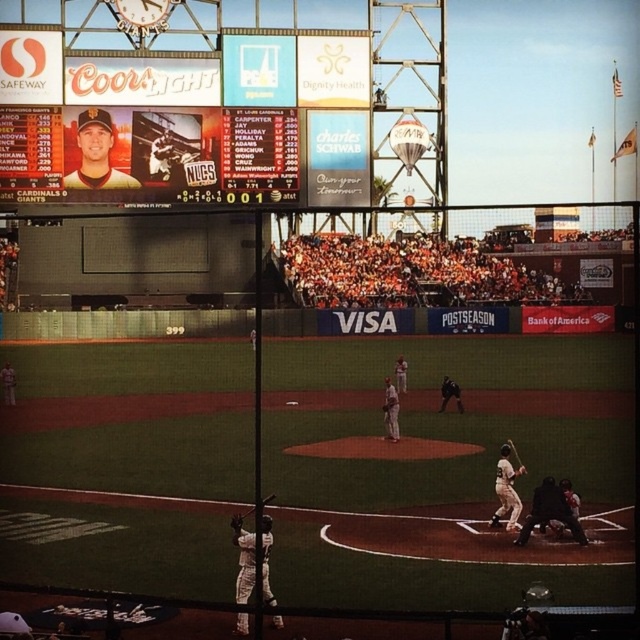
Can you confirm if matte plastic scoreboard at upper center is wider than white uniform bat at center?

Correct, the width of matte plastic scoreboard at upper center exceeds that of white uniform bat at center.

Between point (44, 38) and point (518, 502), which one is positioned behind?

The point (44, 38) is more distant.

Identify the location of matte plastic scoreboard at upper center. (160, 124).

This screenshot has height=640, width=640. What are the coordinates of `matte plastic scoreboard at upper center` in the screenshot? It's located at click(x=160, y=124).

Which is more to the right, matte plastic scoreboard at upper center or wooden baseball bat at center?

From the viewer's perspective, wooden baseball bat at center appears more on the right side.

Consider the image. Does matte plastic scoreboard at upper center lie behind wooden baseball bat at center?

Yes, it is behind wooden baseball bat at center.

Who is more forward, (13,168) or (253,506)?

Point (253,506)

Image resolution: width=640 pixels, height=640 pixels. What are the coordinates of `matte plastic scoreboard at upper center` in the screenshot? It's located at (160, 124).

Who is more forward, [273,116] or [246,554]?

Point [246,554]

Which is behind, point (196, 170) or point (272, 596)?

The point (196, 170) is behind.

Is point (28, 182) farther from viewer compared to point (262, 529)?

Yes, point (28, 182) is farther from viewer.

The image size is (640, 640). I want to click on matte plastic scoreboard at upper center, so click(160, 124).